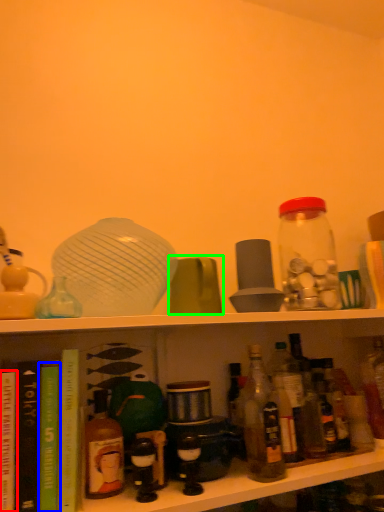
Question: Based on their relative distances, which object is nearer to book (highlighted by a red box)? Choose from book (highlighted by a blue box) and tableware (highlighted by a green box).

Choices:
 (A) book
 (B) tableware

Answer: (A)